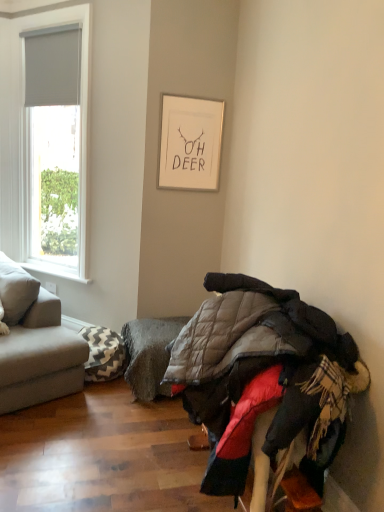
Question: Would you consider gray textured footrest at lower center to be distant from gray fabric blind at upper left?

Choices:
 (A) no
 (B) yes

Answer: (B)

Question: Can you confirm if gray textured footrest at lower center is wider than gray fabric blind at upper left?

Choices:
 (A) yes
 (B) no

Answer: (A)

Question: Considering the relative sizes of gray textured footrest at lower center and gray fabric blind at upper left in the image provided, is gray textured footrest at lower center taller than gray fabric blind at upper left?

Choices:
 (A) yes
 (B) no

Answer: (B)

Question: Does gray textured footrest at lower center lie behind gray fabric blind at upper left?

Choices:
 (A) yes
 (B) no

Answer: (B)

Question: Considering the relative sizes of gray textured footrest at lower center and gray fabric blind at upper left in the image provided, is gray textured footrest at lower center smaller than gray fabric blind at upper left?

Choices:
 (A) no
 (B) yes

Answer: (A)

Question: Considering the positions of gray fabric couch at left and white painted wood at left in the image, is gray fabric couch at left bigger or smaller than white painted wood at left?

Choices:
 (A) big
 (B) small

Answer: (A)

Question: Is point (69, 358) closer or farther from the camera than point (61, 272)?

Choices:
 (A) closer
 (B) farther

Answer: (A)

Question: Based on their positions, is gray fabric couch at left located to the left or right of white painted wood at left?

Choices:
 (A) right
 (B) left

Answer: (B)

Question: From their relative heights in the image, would you say gray fabric couch at left is taller or shorter than white painted wood at left?

Choices:
 (A) short
 (B) tall

Answer: (B)

Question: Is white painted wood at left bigger or smaller than white matte picture frame at upper center?

Choices:
 (A) small
 (B) big

Answer: (A)

Question: From a real-world perspective, relative to white matte picture frame at upper center, is white painted wood at left vertically above or below?

Choices:
 (A) below
 (B) above

Answer: (A)

Question: Relative to white matte picture frame at upper center, is white painted wood at left in front or behind?

Choices:
 (A) behind
 (B) front

Answer: (A)

Question: From the image's perspective, is white painted wood at left located above or below white matte picture frame at upper center?

Choices:
 (A) above
 (B) below

Answer: (B)

Question: Considering the positions of point (172, 328) and point (64, 79), is point (172, 328) closer or farther from the camera than point (64, 79)?

Choices:
 (A) closer
 (B) farther

Answer: (A)

Question: From a real-world perspective, is gray textured footrest at lower center above or below gray fabric blind at upper left?

Choices:
 (A) above
 (B) below

Answer: (B)